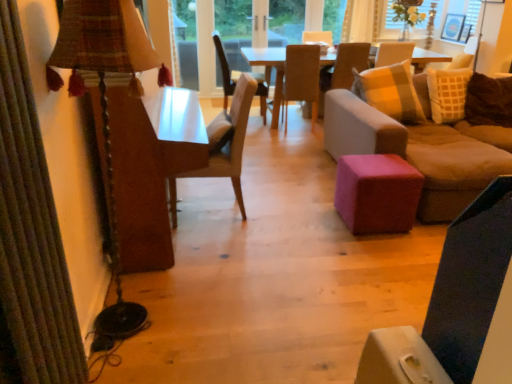
Question: Is the depth of light brown wooden chair at center, which is the fourth chair in left-to-right order, greater than that of wooden chair at center, the first chair when ordered from back to front?

Choices:
 (A) no
 (B) yes

Answer: (A)

Question: Can you confirm if light brown wooden chair at center, marked as the 1th chair in a right-to-left arrangement, is thinner than wooden chair at center, which is counted as the 2th chair, starting from the left?

Choices:
 (A) yes
 (B) no

Answer: (A)

Question: Is wooden chair at center, the first chair when ordered from back to front, at the back of light brown wooden chair at center, marked as the 1th chair in a right-to-left arrangement?

Choices:
 (A) no
 (B) yes

Answer: (A)

Question: Does light brown wooden chair at center, marked as the 1th chair in a right-to-left arrangement, have a lesser height compared to wooden chair at center, positioned as the fourth chair in front-to-back order?

Choices:
 (A) no
 (B) yes

Answer: (A)

Question: Can you confirm if light brown wooden chair at center, which is the fourth chair in left-to-right order, is taller than wooden chair at center, which is counted as the 2th chair, starting from the left?

Choices:
 (A) no
 (B) yes

Answer: (B)

Question: Considering the positions of point (326, 142) and point (505, 125), is point (326, 142) closer or farther from the camera than point (505, 125)?

Choices:
 (A) farther
 (B) closer

Answer: (A)

Question: Relative to woven fabric pillow at right, is pink fabric ottoman at center in front or behind?

Choices:
 (A) behind
 (B) front

Answer: (B)

Question: Considering the positions of pink fabric ottoman at center and woven fabric pillow at right in the image, is pink fabric ottoman at center bigger or smaller than woven fabric pillow at right?

Choices:
 (A) small
 (B) big

Answer: (B)

Question: Is pink fabric ottoman at center wider or thinner than woven fabric pillow at right?

Choices:
 (A) wide
 (B) thin

Answer: (A)

Question: In terms of width, does pink fabric ottoman at center look wider or thinner when compared to light brown wooden chair at center, placed as the 3th chair when sorted from front to back?

Choices:
 (A) wide
 (B) thin

Answer: (B)

Question: Is pink fabric ottoman at center bigger or smaller than light brown wooden chair at center, placed as the 3th chair when sorted from front to back?

Choices:
 (A) big
 (B) small

Answer: (B)

Question: Considering the relative positions of pink fabric ottoman at center and light brown wooden chair at center, marked as the 1th chair in a right-to-left arrangement, in the image provided, is pink fabric ottoman at center to the left or to the right of light brown wooden chair at center, marked as the 1th chair in a right-to-left arrangement,?

Choices:
 (A) right
 (B) left

Answer: (B)

Question: From their relative heights in the image, would you say pink fabric ottoman at center is taller or shorter than light brown wooden chair at center, marked as the 1th chair in a right-to-left arrangement?

Choices:
 (A) tall
 (B) short

Answer: (B)

Question: From the image's perspective, is woven fabric pillow at right above or below white fabric at upper right?

Choices:
 (A) above
 (B) below

Answer: (B)

Question: Is woven fabric pillow at right wider or thinner than white fabric at upper right?

Choices:
 (A) thin
 (B) wide

Answer: (B)